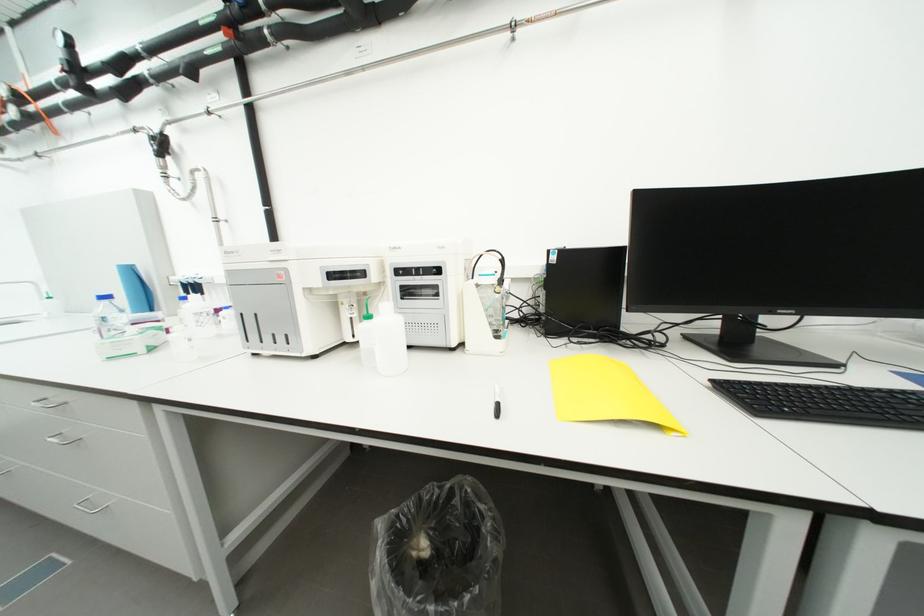
Find where to lift the white squeeze bottle. Please return your answer as a coordinate pair (x, y).

(390, 341)